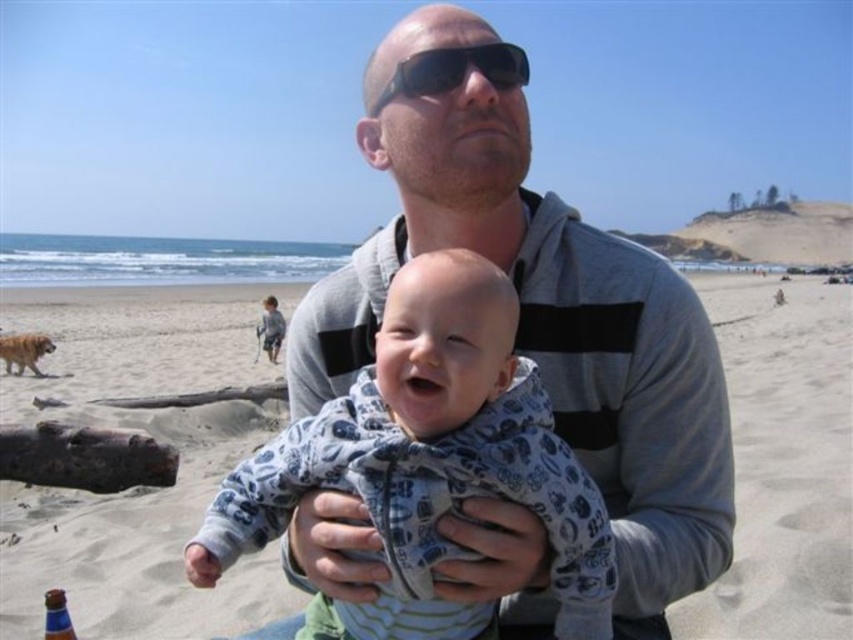
Question: Is black plastic sunglasses at upper center above blue plastic bottle at lower left?

Choices:
 (A) no
 (B) yes

Answer: (B)

Question: Can you confirm if gray hoodie at center is thinner than blue cotton onesie at center?

Choices:
 (A) yes
 (B) no

Answer: (B)

Question: Which of the following is the farthest from the observer?

Choices:
 (A) blue cotton onesie at center
 (B) gray hoodie at center
 (C) black plastic sunglasses at upper center

Answer: (C)

Question: Among these objects, which one is nearest to the camera?

Choices:
 (A) gray hoodie at center
 (B) blue cotton onesie at center
 (C) blue plastic bottle at lower left
 (D) black plastic sunglasses at upper center

Answer: (B)

Question: Can you confirm if blue cotton onesie at center is wider than blue plastic bottle at lower left?

Choices:
 (A) no
 (B) yes

Answer: (B)

Question: Which of the following is the farthest from the observer?

Choices:
 (A) gray hoodie at center
 (B) blue cotton onesie at center
 (C) black plastic sunglasses at upper center
 (D) blue plastic bottle at lower left

Answer: (D)